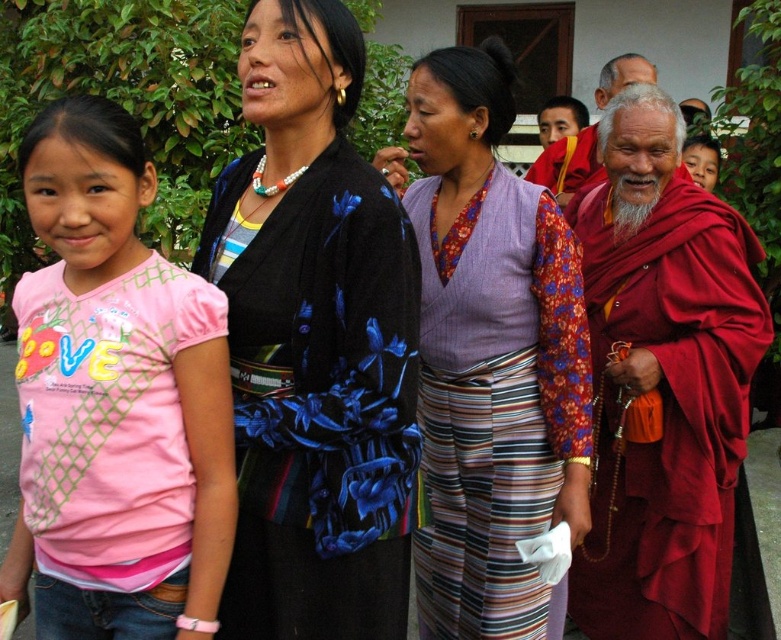
Based on the scene description, where is the purple woven vest at center located in terms of its coordinates?

The purple woven vest at center is located at coordinates point (x=490, y=355).

In the scene described, there is a purple woven vest at center and a red robe monk at upper right. Which object is taller?

The purple woven vest at center is taller than the red robe monk at upper right.